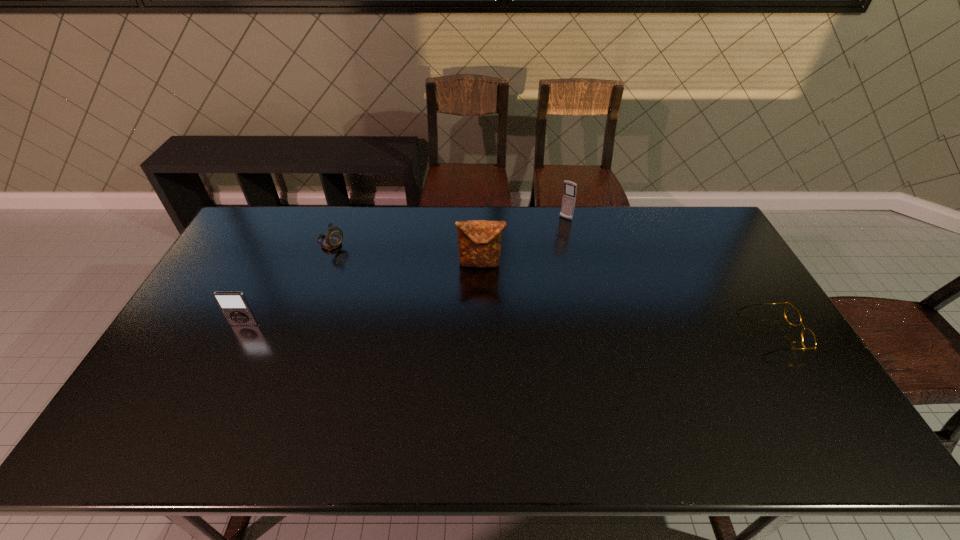
Find the location of a particular element. cellular telephone situated at the far edge is located at coordinates (569, 197).

You are a GUI agent. You are given a task and a screenshot of the screen. Output one action in this format:
    pyautogui.click(x=<x>, y=<y>)
    Task: Click on the compass that is at the far edge
    Image resolution: width=960 pixels, height=540 pixels.
    Given the screenshot: What is the action you would take?
    pyautogui.click(x=334, y=236)

I want to click on object that is at the left edge, so click(x=234, y=305).

Find the location of `object present at the right edge`. object present at the right edge is located at coordinates (791, 314).

The width and height of the screenshot is (960, 540). In the image, there is a desktop. What are the coordinates of `free space at the far edge` in the screenshot? It's located at (405, 237).

Locate an element on the screen. The width and height of the screenshot is (960, 540). vacant space at the near edge is located at coordinates (289, 395).

You are a GUI agent. You are given a task and a screenshot of the screen. Output one action in this format:
    pyautogui.click(x=<x>, y=<y>)
    Task: Click on the vacant space at the left edge
    
    Given the screenshot: What is the action you would take?
    pyautogui.click(x=202, y=337)

I want to click on free region at the right edge, so click(x=715, y=303).

The image size is (960, 540). In the image, there is a desktop. In order to click on vacant space at the far right corner in this screenshot , I will do `click(676, 219)`.

The width and height of the screenshot is (960, 540). Identify the location of free space between the fourth object from left to right and the clutch bag. (523, 241).